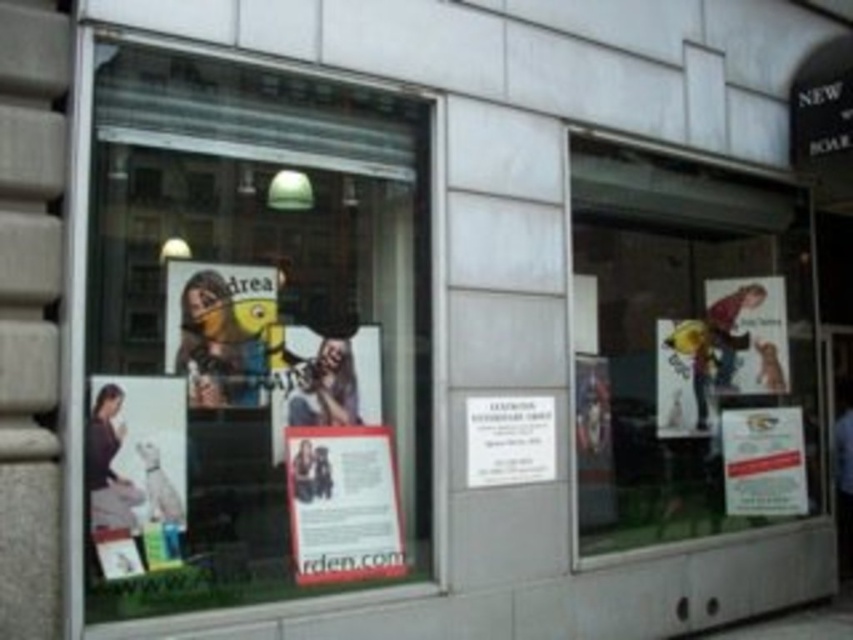
Is white paper poster at right shorter than matte paper poster at right?

Incorrect, white paper poster at right's height does not fall short of matte paper poster at right's.

Does white paper poster at right have a larger size compared to matte paper poster at right?

Yes, white paper poster at right is bigger than matte paper poster at right.

The width and height of the screenshot is (853, 640). Describe the element at coordinates (682, 339) in the screenshot. I see `white paper poster at right` at that location.

Identify the location of white paper poster at right. The image size is (853, 640). (682, 339).

Is matte paper poster at lower left further to the viewer compared to matte paper poster at center?

No, it is not.

Is point (120, 401) positioned after point (287, 401)?

No, it is in front of (287, 401).

Between point (152, 493) and point (288, 406), which one is positioned behind?

The point (288, 406) is more distant.

At what (x,y) coordinates should I click in order to perform the action: click on matte paper poster at lower left. Please return your answer as a coordinate pair (x, y). Image resolution: width=853 pixels, height=640 pixels. Looking at the image, I should click on (136, 470).

Based on the photo, between matte paper poster at center and matte paper poster at right, which one is positioned lower?

matte paper poster at center is below.

Who is positioned more to the left, matte paper poster at center or matte paper poster at right?

matte paper poster at center

Is point (376, 346) closer to viewer compared to point (769, 326)?

Yes, point (376, 346) is closer to viewer.

The width and height of the screenshot is (853, 640). Identify the location of matte paper poster at center. (325, 381).